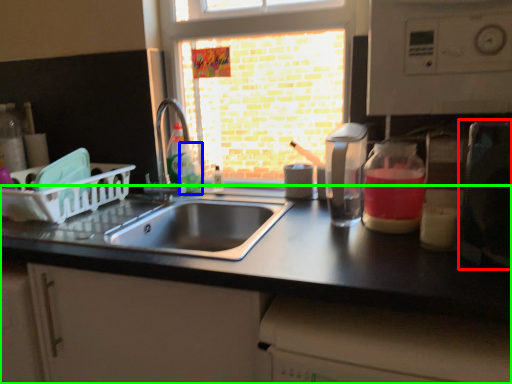
Question: Based on their relative distances, which object is farther from appliance (highlighted by a red box)? Choose from bottle (highlighted by a blue box) and countertop (highlighted by a green box).

Choices:
 (A) bottle
 (B) countertop

Answer: (A)